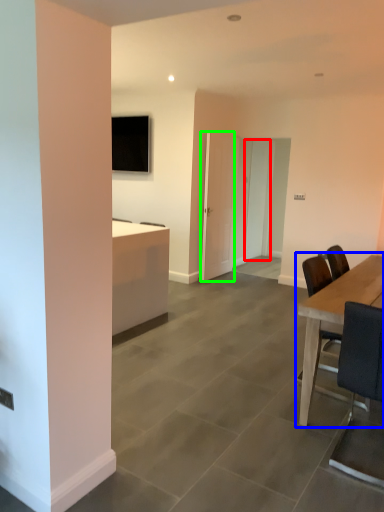
Question: Which object is positioned closest to glass door (highlighted by a red box)? Select from table (highlighted by a blue box) and glass door (highlighted by a green box).

Choices:
 (A) table
 (B) glass door

Answer: (B)